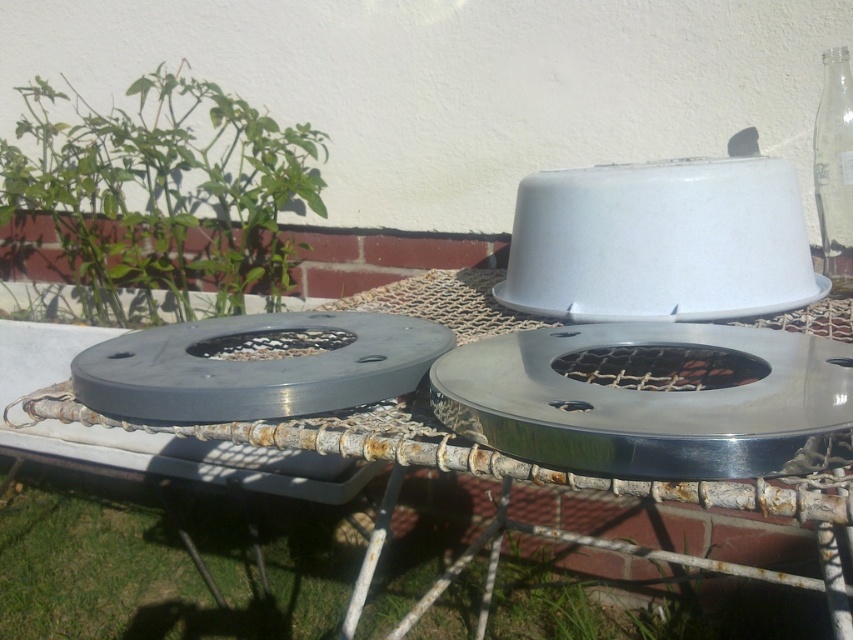
You are planning to place a large rectangular picnic blanket on the ground. Given the presence of the green grass at lower left and the satin silver grill at center, which area would allow the blanket to cover more of the ground without overlapping any objects?

The green grass at lower left is larger in size than the satin silver grill at center, so placing the picnic blanket there would cover more ground without overlapping any objects.

You are standing on the patio and want to place a small potted plant between the green grass at lower left and the matte gray grill at center. Based on their positions, where should you place the potted plant?

The green grass at lower left is located below the matte gray grill at center, so you should place the potted plant between them by positioning it under the matte gray grill at center and above the green grass at lower left.